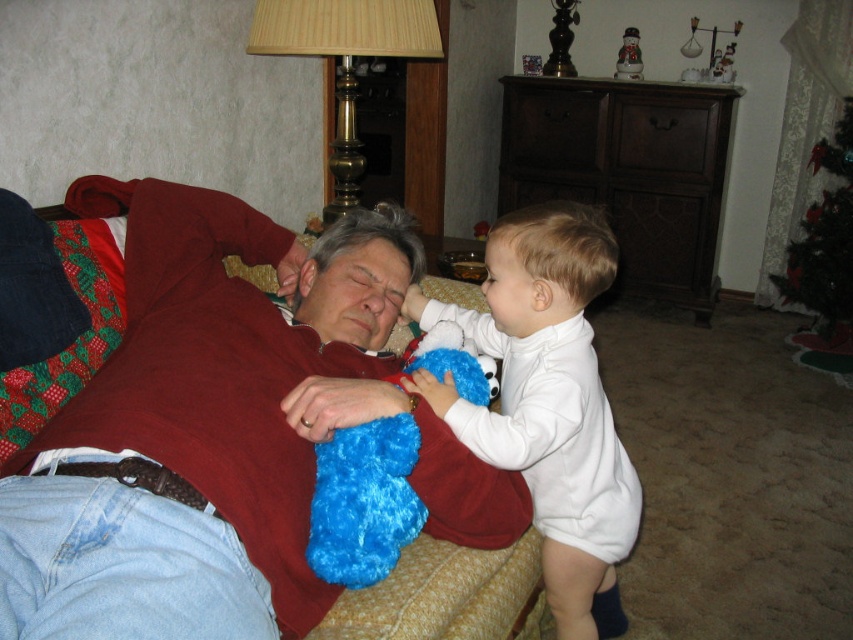
You are planning to place a new rectangular shelf that is 1.2 meters wide between the gold brass lamp at upper center and the green shiny christmas tree at upper right. Given the current spacing between them, will the shelf fit without needing to move either object?

The gold brass lamp at upper center has a larger width than the green shiny christmas tree at upper right. However, the description only provides information about their widths, not the distance between them. Therefore, it is impossible to determine if the 1.2 meter wide shelf will fit without knowing the actual spacing between the two objects.

You are a guest in this living room and want to place a small gift under the green shiny christmas tree at upper right. However, there is a fuzzy blue stuffed toy at upper center in the way. Can you move the stuffed toy to make space? Explain your reasoning based on their positions.

The fuzzy blue stuffed toy at upper center is below the green shiny christmas tree at upper right, so it is positioned lower and closer to the base of the tree. Moving it would create space underneath the tree for the gift.